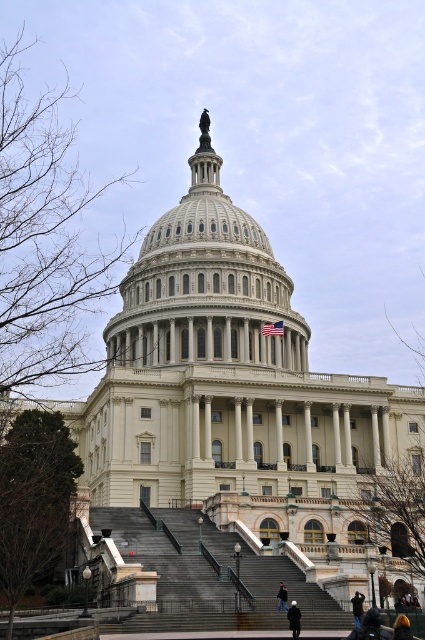
Who is positioned more to the right, orange hair at lower right or black leather jacket at lower right?

orange hair at lower right

Can you confirm if orange hair at lower right is bigger than black leather jacket at lower right?

Yes.

Identify the location of orange hair at lower right. (402, 627).

Image resolution: width=425 pixels, height=640 pixels. Identify the location of orange hair at lower right. (402, 627).

Is point (159, 320) positioned after point (299, 621)?

Yes, point (159, 320) is farther from viewer.

Can you confirm if white marble dome at center is wider than dark blue jeans at lower center?

Yes.

Who is more forward, [280,298] or [295,614]?

Positioned in front is point [295,614].

Image resolution: width=425 pixels, height=640 pixels. I want to click on white marble dome at center, so click(201, 276).

Find the location of a particular element. The image size is (425, 640). orange hair at lower right is located at coordinates (402, 627).

Does orange hair at lower right have a lesser width compared to black fabric person at center?

No, orange hair at lower right is not thinner than black fabric person at center.

Which is behind, point (396, 632) or point (277, 593)?

The point (277, 593) is more distant.

Identify the location of orange hair at lower right. The height and width of the screenshot is (640, 425). point(402,627).